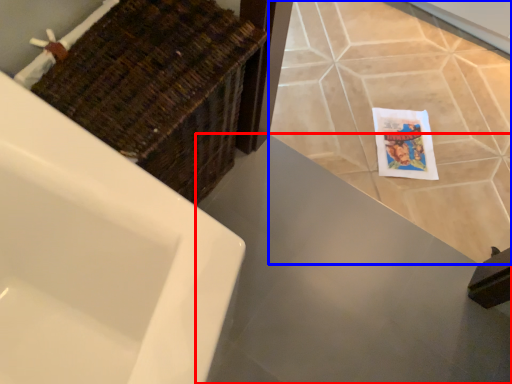
Question: Which of the following is the farthest to the observer, counter top (highlighted by a red box) or ceramic tile (highlighted by a blue box)?

Choices:
 (A) counter top
 (B) ceramic tile

Answer: (B)